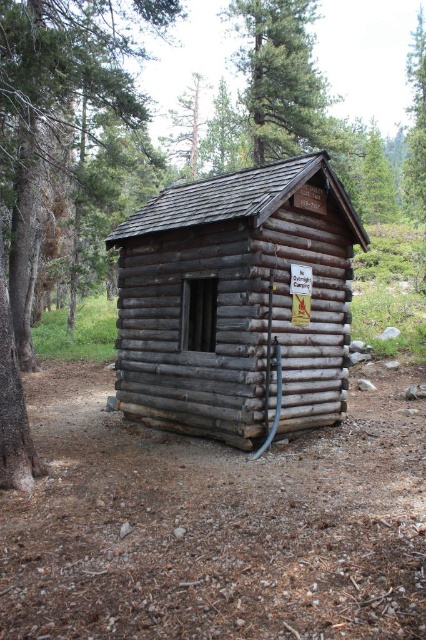
You are planning to build a treehouse in the forest near the gray wooden log cabin at center and the green leafy tree at upper center. Which object would be a better choice for the treehouse base considering their heights?

The green leafy tree at upper center is taller than the gray wooden log cabin at center, making it a better choice for building a treehouse base due to its greater height.

You are standing in front of the rustic wooden cabin. There is a point marked at coordinates (36, 141). What is located at that point?

The smooth brown bark at left is located at point (36, 141).